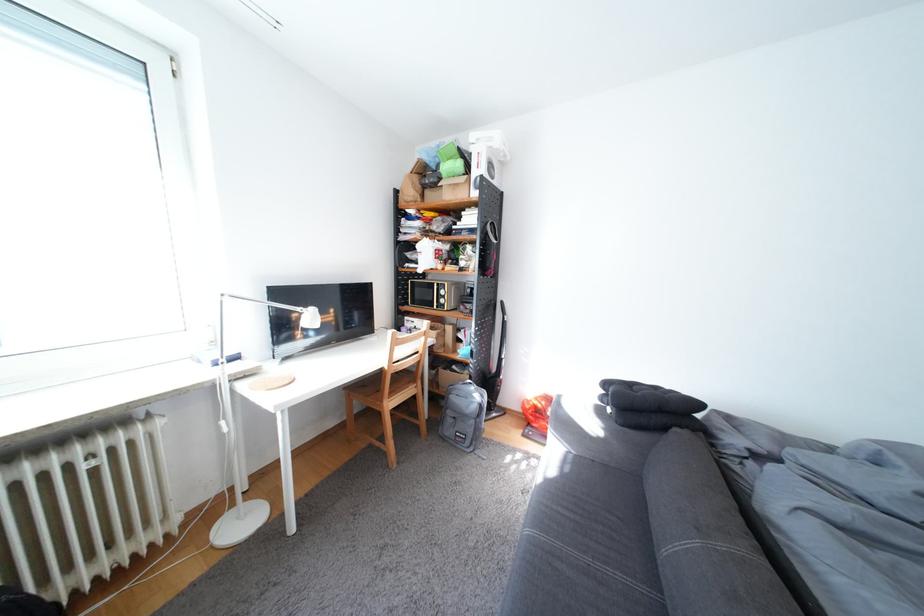
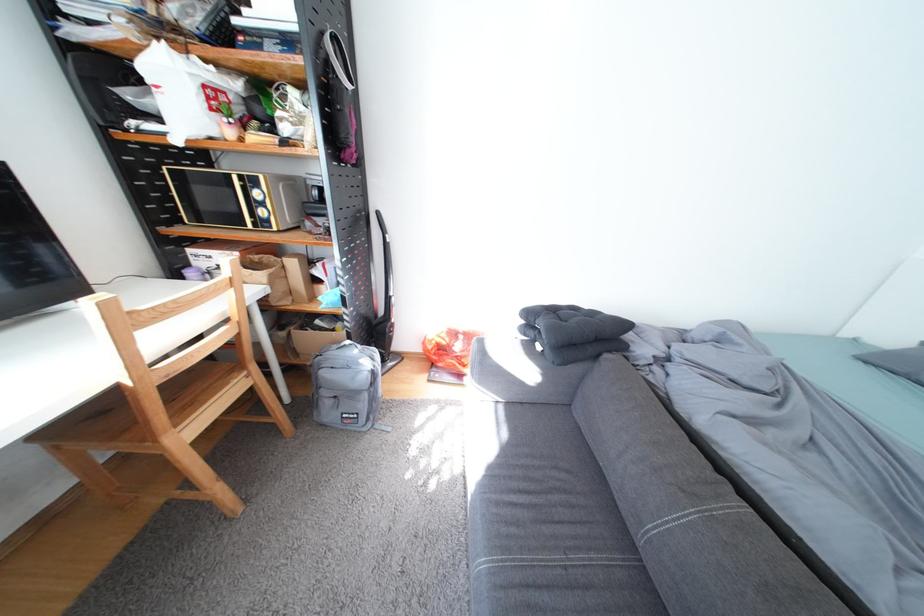
Where in the second image is the point corresponding to (x=406, y=376) from the first image?

(176, 387)